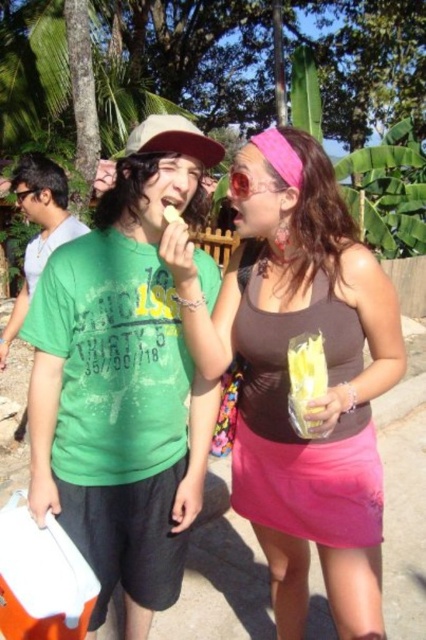
You are standing in the scene and need to hand a note to the person wearing the green matte shirt at center. Based on their position, in which direction should you walk to reach them?

The green matte shirt at center is located at point (123,380), so you should walk towards the lower right direction to reach them.

Consider the image. You are a photographer trying to capture a candid shot of the two people in the scene. You want to ensure that both the green matte shirt at center and the yellow matte food at mouth are clearly visible in your photo. Based on their positions, which object should you focus on first to ensure both are in frame?

The green matte shirt at center is positioned on the left side of yellow matte food at mouth, so you should focus on the green matte shirt at center first to ensure both are in frame.

You are standing in front of the two people in the image. Which of the two points, point (143, 324) or point (175, 211), is closer to you?

Point (143, 324) is closer to you because it is further to the viewer than point (175, 211).